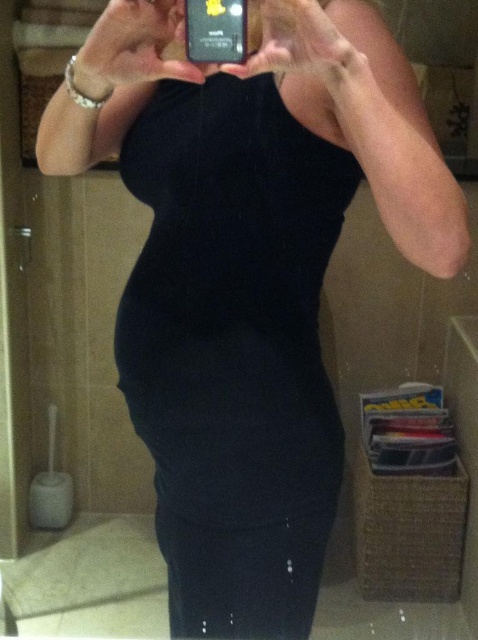
You are a fashion designer who wants to create a new line of clothing. You are looking at the image and notice the black velvet dress at center and the black plastic phone at upper center. Which object is wider in the image?

The black velvet dress at center is wider than the black plastic phone at upper center in the image.

You are a fashion designer who needs to determine the relative sizes of the black velvet dress at center and the black plastic phone at upper center in the image. Which object is taller?

The black velvet dress at center is taller than the black plastic phone at upper center.

You are a fashion designer who wants to showcase a new dress design. You have a black velvet dress at center and a black plastic phone at upper center. Can you place the dress closer to the phone than 20 inches to ensure it appears in the photo frame?

The black velvet dress at center is 18.34 inches away from the black plastic phone at upper center, which is within the 20 inches requirement. Therefore, the dress will appear in the photo frame.